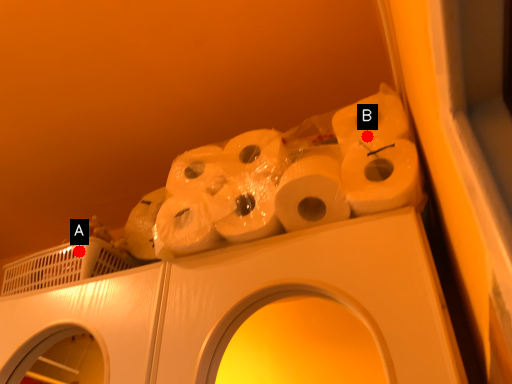
Question: Two points are circled on the image, labeled by A and B beside each circle. Which of the following is the farthest from the observer?

Choices:
 (A) A is further
 (B) B is further

Answer: (A)